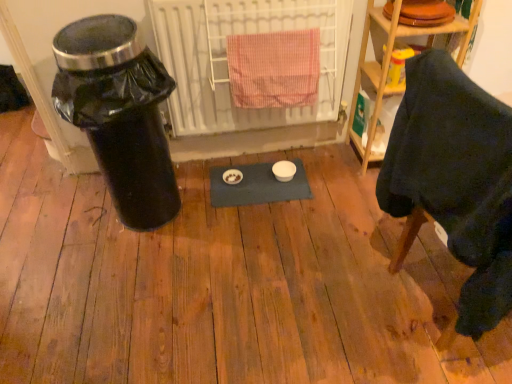
Locate an element on the screen. Image resolution: width=512 pixels, height=384 pixels. vacant space situated on the left part of black plastic trash can at left is located at coordinates (69, 217).